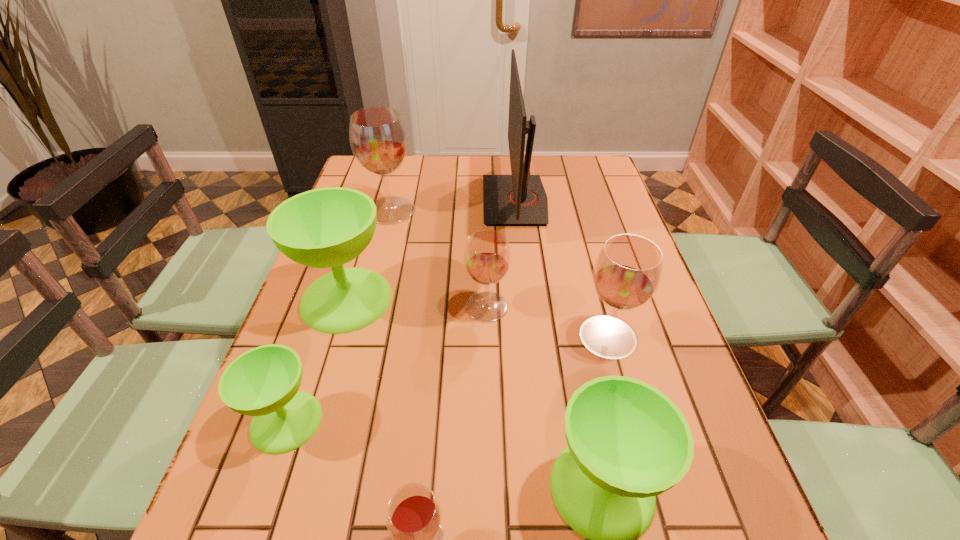
Choose which wineglass is the second nearest neighbor to the tallest object. Please provide its 2D coordinates. Your answer should be formatted as a tuple, i.e. [(x, y)], where the tuple contains the x and y coordinates of a point satisfying the conditions above.

[(378, 139)]

Where is `red wineglass object that ranks as the closest to the third wineglass from right to left`? This screenshot has height=540, width=960. red wineglass object that ranks as the closest to the third wineglass from right to left is located at coordinates pos(627,272).

Identify which red wineglass is the second closest to the smallest green wineglass. Please provide its 2D coordinates. Your answer should be formatted as a tuple, i.e. [(x, y)], where the tuple contains the x and y coordinates of a point satisfying the conditions above.

[(487, 256)]

The width and height of the screenshot is (960, 540). In order to click on green wineglass that is the second closest to the biggest red wineglass in this screenshot , I will do `click(263, 382)`.

Choose which green wineglass is the second nearest neighbor to the rightmost green wineglass. Please provide its 2D coordinates. Your answer should be formatted as a tuple, i.e. [(x, y)], where the tuple contains the x and y coordinates of a point satisfying the conditions above.

[(263, 382)]

Where is `vacant space that satisfies the following two spatial constraints: 1. on the front side of the biggest green wineglass; 2. on the left side of the second biggest red wineglass`? The height and width of the screenshot is (540, 960). vacant space that satisfies the following two spatial constraints: 1. on the front side of the biggest green wineglass; 2. on the left side of the second biggest red wineglass is located at coordinates (335, 336).

Locate an element on the screen. vacant point that satisfies the following two spatial constraints: 1. on the screen side of the tallest object; 2. on the front side of the smallest green wineglass is located at coordinates (539, 421).